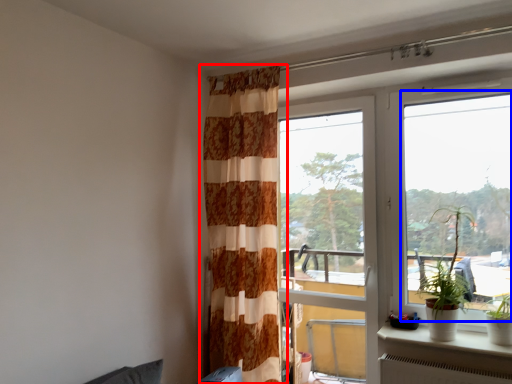
Question: Which of the following is the closest to the observer, curtain (highlighted by a red box) or window (highlighted by a blue box)?

Choices:
 (A) curtain
 (B) window

Answer: (B)